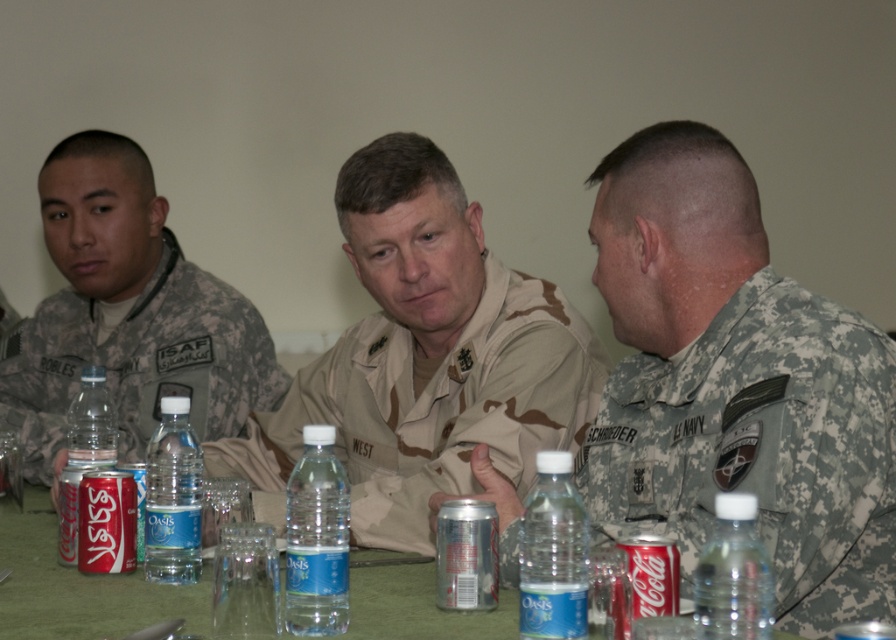
Question: Which object is closer to the camera taking this photo?

Choices:
 (A) camouflage fabric uniform at center
 (B) camouflage uniform at left
 (C) silver metallic can at center
 (D) red matte can at lower left

Answer: (C)

Question: Which point is closer to the camera taking this photo?

Choices:
 (A) (731, 634)
 (B) (154, 381)

Answer: (A)

Question: Can you confirm if clear plastic bottle at lower right is positioned below silver metallic can at center?

Choices:
 (A) no
 (B) yes

Answer: (A)

Question: Where is camouflage uniform at center located in relation to blue translucent bottle at lower right in the image?

Choices:
 (A) right
 (B) left

Answer: (A)

Question: Is camouflage uniform at center wider than clear glass water at center?

Choices:
 (A) yes
 (B) no

Answer: (A)

Question: Which point appears farthest from the camera in this image?

Choices:
 (A) (76, 532)
 (B) (627, 380)
 (C) (481, 580)

Answer: (B)